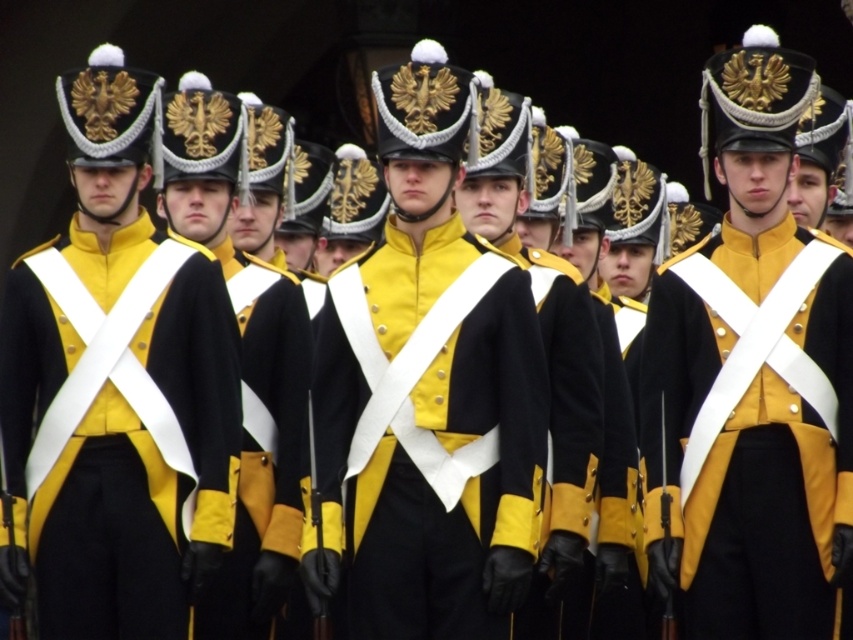
Does black matte uniform at center have a greater height compared to black wool coat at center?

No.

Measure the distance between black matte uniform at center and black wool coat at center.

black matte uniform at center and black wool coat at center are 14.61 feet apart from each other.

Does point (514, 269) come behind point (227, 620)?

No, it is not.

The height and width of the screenshot is (640, 853). I want to click on black matte uniform at center, so click(428, 429).

Does yellow matte fabric coat at center have a greater height compared to black matte uniform at center?

Correct, yellow matte fabric coat at center is much taller as black matte uniform at center.

Does yellow matte fabric coat at center lie in front of black matte uniform at center?

No, it is behind black matte uniform at center.

Is point (238, 364) farther from viewer compared to point (479, 285)?

Yes, it is.

Image resolution: width=853 pixels, height=640 pixels. I want to click on yellow matte fabric coat at center, so coord(115,432).

Does point (119, 273) come closer to viewer compared to point (291, 308)?

Yes, point (119, 273) is in front of point (291, 308).

Which is behind, point (193, 528) or point (247, 540)?

The point (247, 540) is behind.

Which is in front, point (96, 620) or point (206, 618)?

Point (96, 620) is more forward.

The width and height of the screenshot is (853, 640). I want to click on yellow matte fabric coat at center, so click(x=115, y=432).